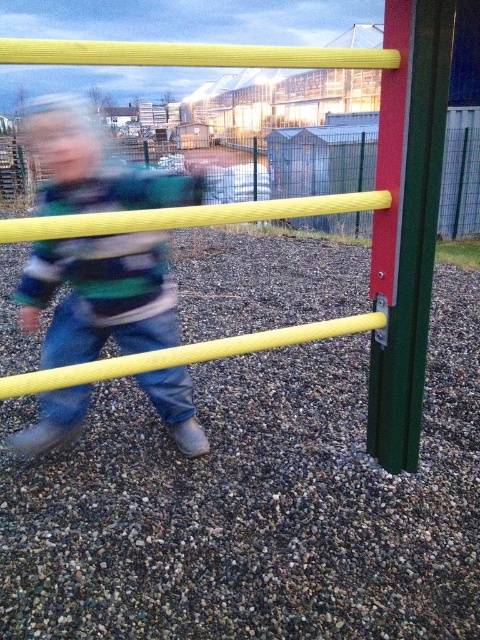
Based on the photo, is matte yellow pole at center taller than green matte pole at right?

In fact, matte yellow pole at center may be shorter than green matte pole at right.

Between matte yellow pole at center and green matte pole at right, which one appears on the right side from the viewer's perspective?

green matte pole at right

Locate an element on the screen. The height and width of the screenshot is (640, 480). matte yellow pole at center is located at coordinates (100, 296).

Locate an element on the screen. This screenshot has height=640, width=480. matte yellow pole at center is located at coordinates (100, 296).